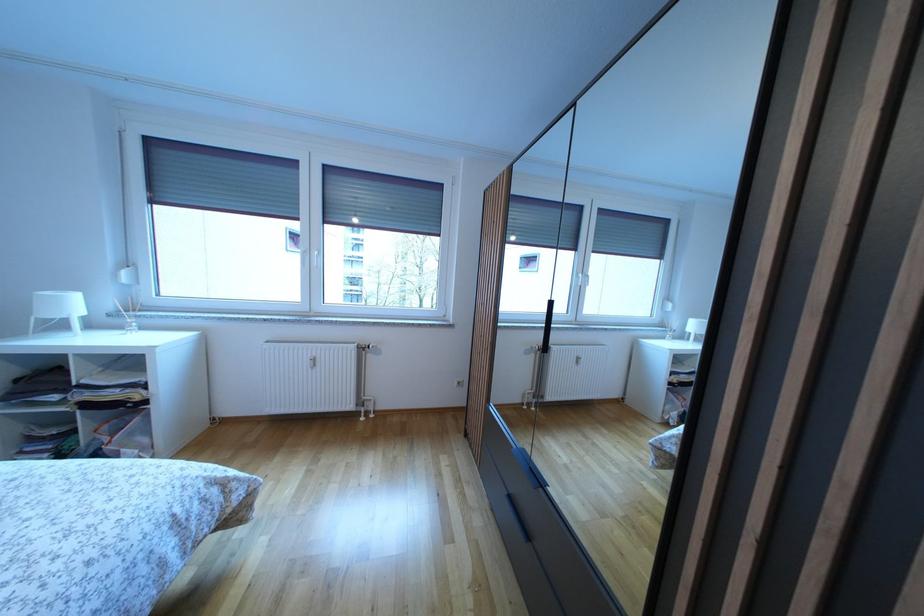
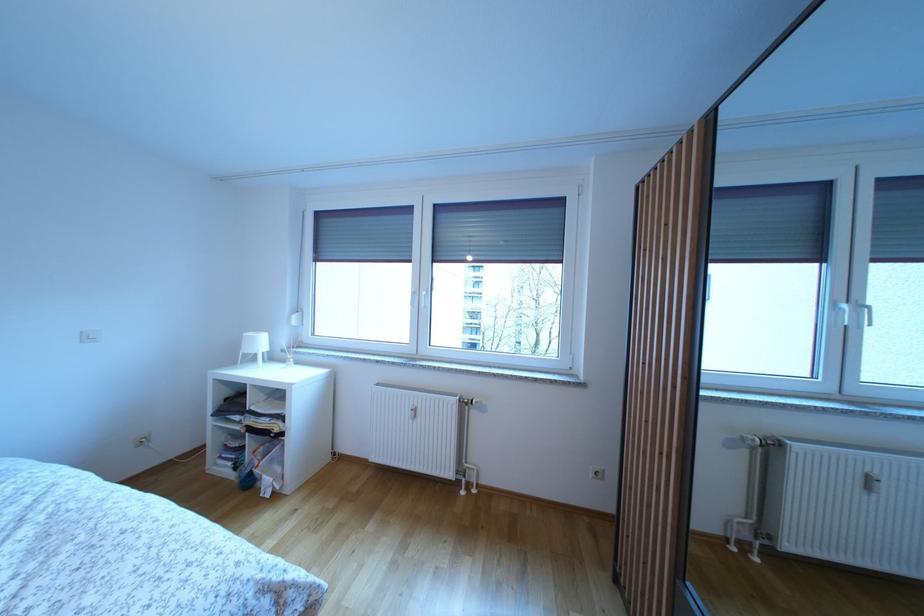
Question: The images are taken continuously from a first-person perspective. In which direction are you moving?

Choices:
 (A) Left
 (B) Right
 (C) Forward
 (D) Backward

Answer: (C)